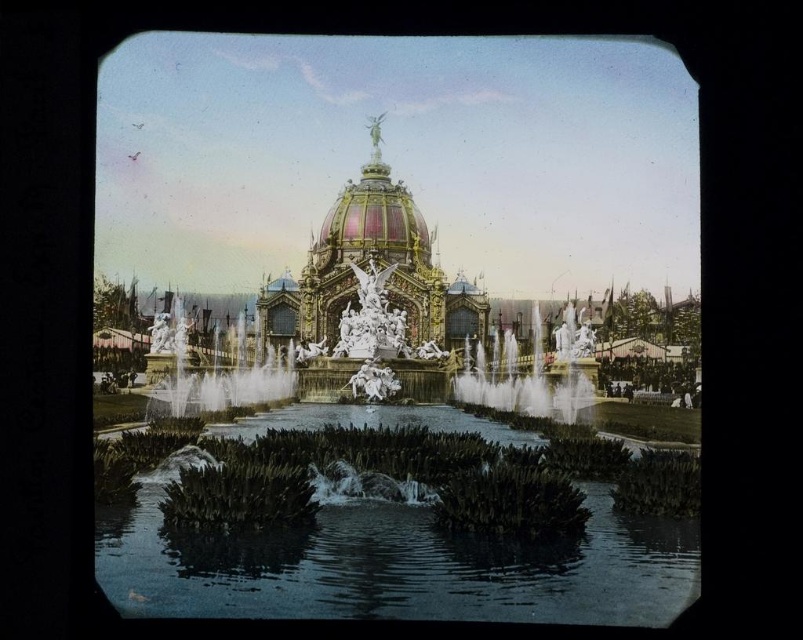
Question: Is clear water at center positioned at the back of white marble fountain at center?

Choices:
 (A) no
 (B) yes

Answer: (A)

Question: Among these objects, which one is nearest to the camera?

Choices:
 (A) clear water at center
 (B) gold/gilded dome at center

Answer: (A)

Question: Is clear water at center above polished bronze fountain at center?

Choices:
 (A) yes
 (B) no

Answer: (B)

Question: Which object appears farthest from the camera in this image?

Choices:
 (A) white marble fountain at center
 (B) gold/gilded dome at center
 (C) polished bronze fountain at center

Answer: (B)

Question: Which object is positioned farthest from the polished bronze fountain at center?

Choices:
 (A) white marble fountain at center
 (B) clear water at center
 (C) gold/gilded dome at center

Answer: (A)

Question: Does clear water at center have a lesser width compared to white marble fountain at center?

Choices:
 (A) yes
 (B) no

Answer: (B)